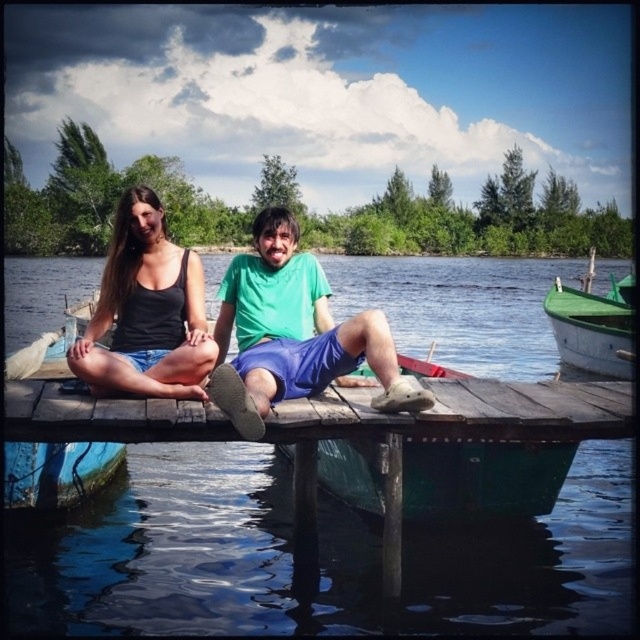
You are standing on the dock and want to hand a life jacket to the person wearing the green matte shirt at center. Which direction should you walk to reach them without passing the green wooden boat at right?

The green matte shirt at center is closer to the viewer than the green wooden boat at right, so you should walk towards the green matte shirt at center in the direction opposite to the green wooden boat at right to avoid passing it.

You are planning to place a new bench on the dock. The bench requires 1.5 meters of space. Given the current objects on the dock, which are the matte black tank top at center and the green wooden boat at right, can you determine if there is enough space between them to place the bench?

The matte black tank top at center is narrower than the green wooden boat at right. Since the bench requires 1.5 meters of space, and the width of the matte black tank top at center is less than the green wooden boat at right, there might be sufficient space between them to accommodate the bench. However, the exact dimensions of the objects and their arrangement are needed for a precise determination.